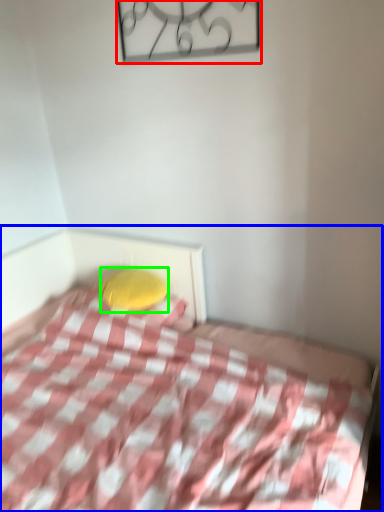
Question: Which is nearer to the design (highlighted by a red box)? bed (highlighted by a blue box) or pillow (highlighted by a green box).

Choices:
 (A) bed
 (B) pillow

Answer: (B)